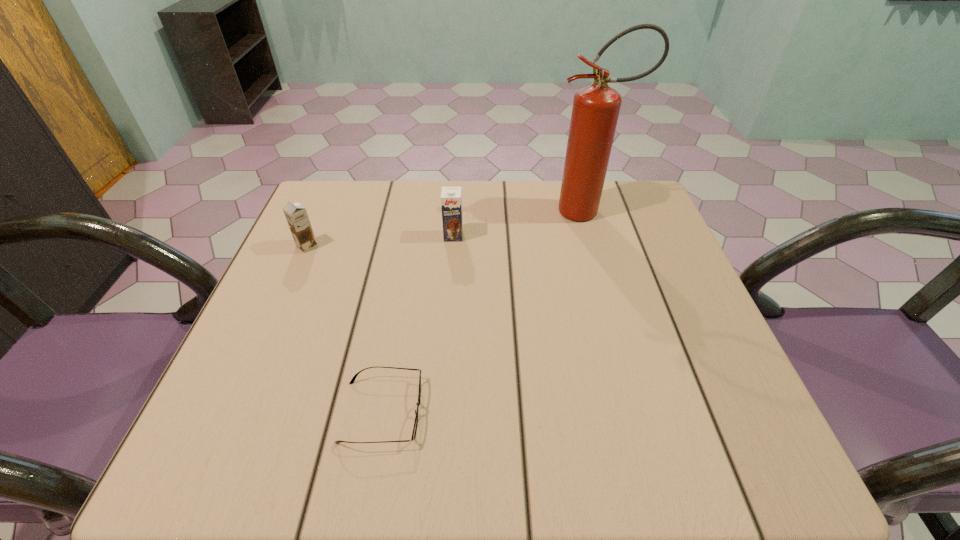
In order to click on free region located on the front of the leftmost object in this screenshot , I will do `click(273, 325)`.

Identify the location of vacant space situated 0.260m on the front-facing side of the shortest object. This screenshot has width=960, height=540. tap(574, 411).

Locate an element on the screen. fire extinguisher located at the far edge is located at coordinates (595, 111).

Locate an element on the screen. chocolate milk at the far edge is located at coordinates (451, 199).

Image resolution: width=960 pixels, height=540 pixels. What are the coordinates of `object that is at the near edge` in the screenshot? It's located at (353, 379).

What are the coordinates of `object that is at the left edge` in the screenshot? It's located at (296, 215).

I want to click on object located at the right edge, so click(x=595, y=111).

Image resolution: width=960 pixels, height=540 pixels. In order to click on object that is at the far right corner in this screenshot , I will do pos(595,111).

In the image, there is a desktop. In order to click on free space at the far edge in this screenshot , I will do click(x=379, y=200).

This screenshot has height=540, width=960. What are the coordinates of `free space at the near edge` in the screenshot? It's located at [x=411, y=457].